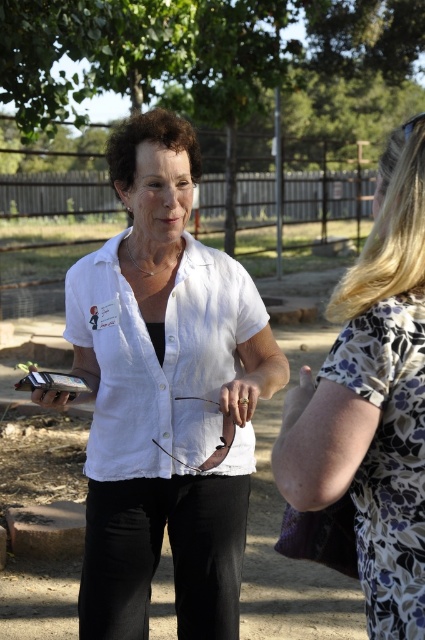
You are trying to decide which shirt to wear for a casual day out. Both the white matte shirt at center and the white linen shirt at center are options. Based on their appearance in the image, which one might be more comfortable for hot weather?

The white linen shirt at center is typically made of a breathable fabric, making it more comfortable for hot weather compared to the white matte shirt at center.

Where is the white matte shirt at center located in the image?

The white matte shirt at center is located at point 0.619 in the x coordinate and 0.388 in the y coordinate.